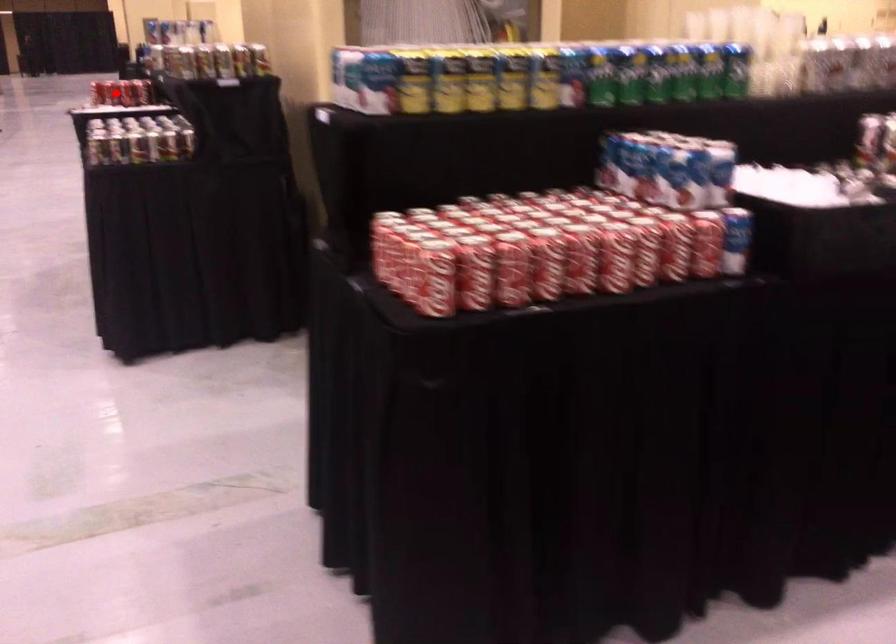
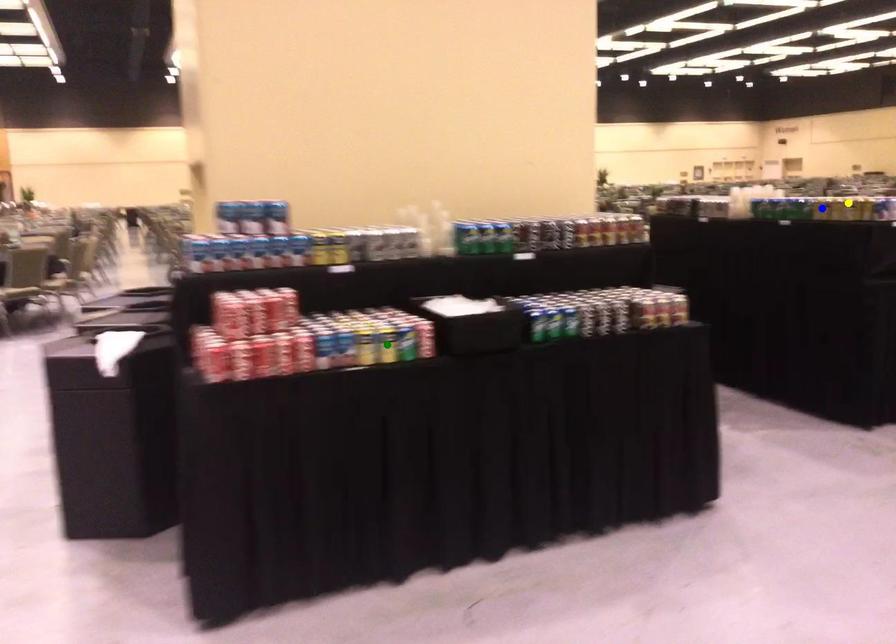
Question: I am providing you with two images of the same scene from different viewpoints. A red point is marked on the first image. You are given multiple points on the second image. In image 2, which mark is for the same physical point as the one in image 1?

Choices:
 (A) blue point
 (B) yellow point
 (C) green point

Answer: (C)